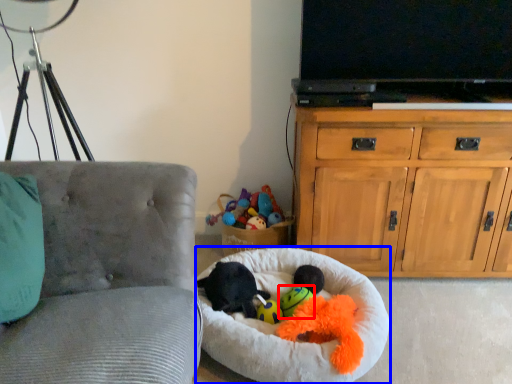
Question: Which object is further to the camera taking this photo, toy (highlighted by a red box) or dog bed (highlighted by a blue box)?

Choices:
 (A) toy
 (B) dog bed

Answer: (A)